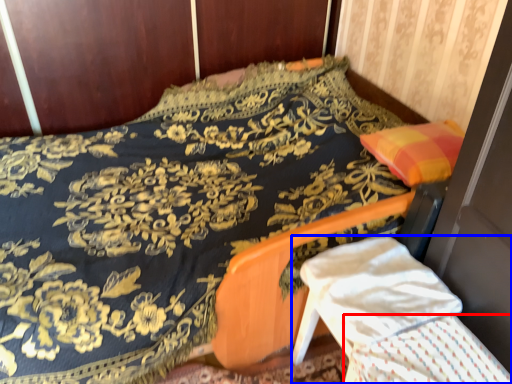
Question: Which point is further to the camera, blanket (highlighted by a red box) or armchair (highlighted by a blue box)?

Choices:
 (A) blanket
 (B) armchair

Answer: (B)